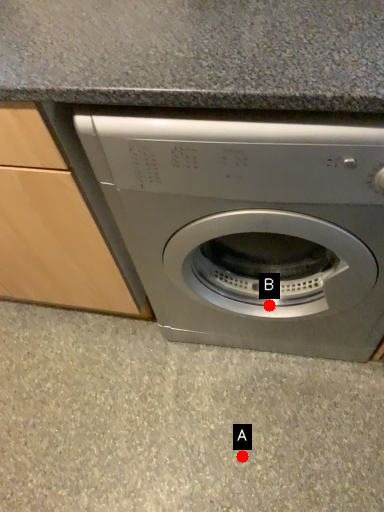
Question: Two points are circled on the image, labeled by A and B beside each circle. Which point is closer to the camera?

Choices:
 (A) A is closer
 (B) B is closer

Answer: (B)